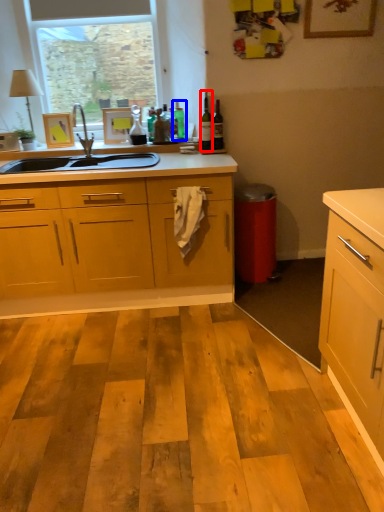
Question: Which object is closer to the camera taking this photo, bottle (highlighted by a red box) or bottle (highlighted by a blue box)?

Choices:
 (A) bottle
 (B) bottle

Answer: (A)